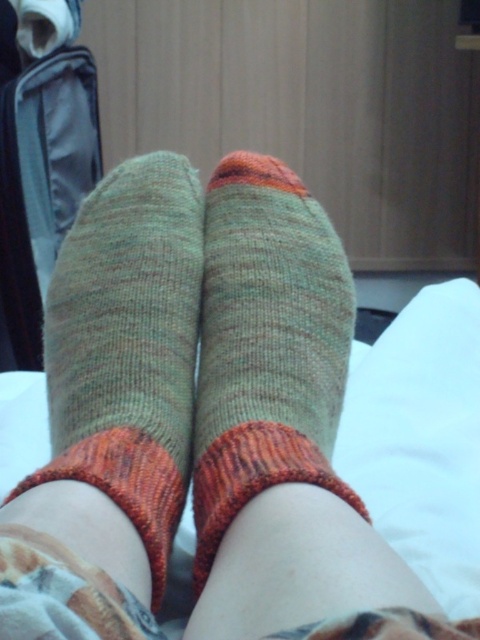
You are trying to put on your socks but you can only see the top part. Based on the image, which sock is closer to your hand when you are holding the knitted wool socks at center and the green knitted sock at center?

The green knitted sock at center is closer to your hand because it is positioned over the knitted wool socks at center.

You are trying to choose a pair of socks to wear. You see the knitted wool socks at center and the green knitted sock at center. Which one is bigger?

The knitted wool socks at center is larger in size compared to the green knitted sock at center.